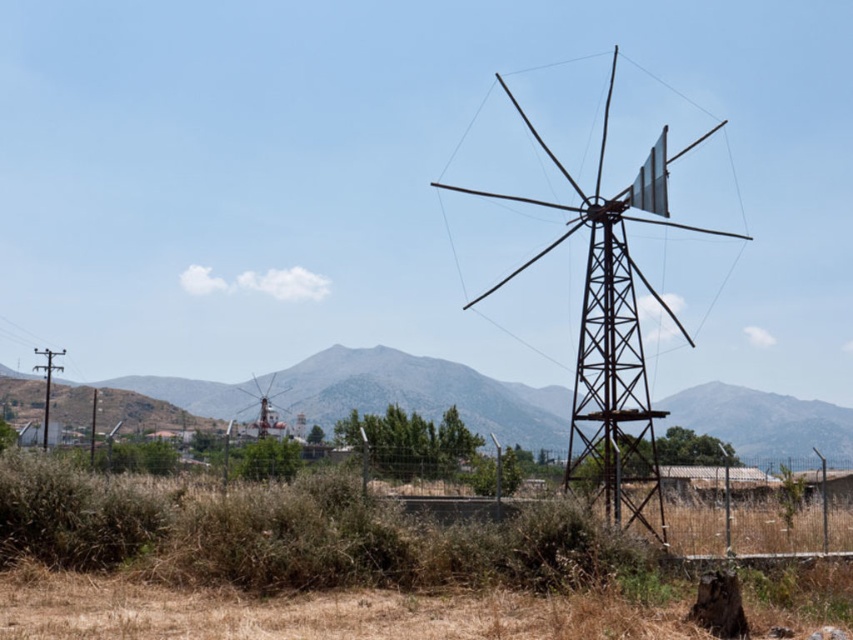
Question: Does dry grass at center have a greater width compared to rusty metal windmill at center?

Choices:
 (A) yes
 (B) no

Answer: (A)

Question: Is dry grass at center to the left of rustic stone mountain at center from the viewer's perspective?

Choices:
 (A) no
 (B) yes

Answer: (B)

Question: Is dry grass at center wider than rusty metal windmill at center?

Choices:
 (A) yes
 (B) no

Answer: (A)

Question: Which is farther from the rustic stone mountain at center?

Choices:
 (A) rusty metal windmill at center
 (B) dry grass at center

Answer: (B)

Question: Which of these objects is positioned closest to the rustic stone mountain at center?

Choices:
 (A) rusty metal windmill at center
 (B) dry grass at center

Answer: (A)

Question: Which point is closer to the camera taking this photo?

Choices:
 (A) (502, 400)
 (B) (608, 323)
 (C) (502, 564)

Answer: (C)